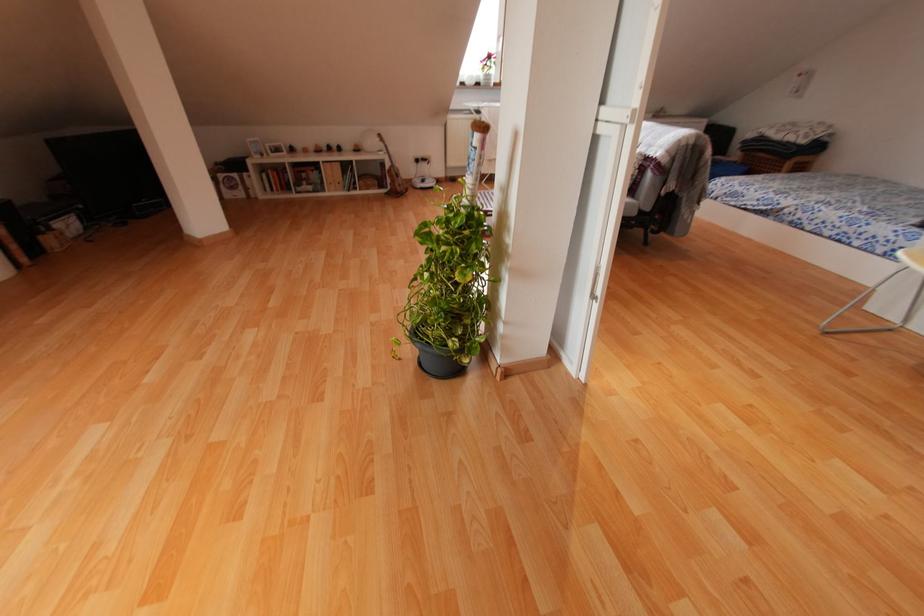
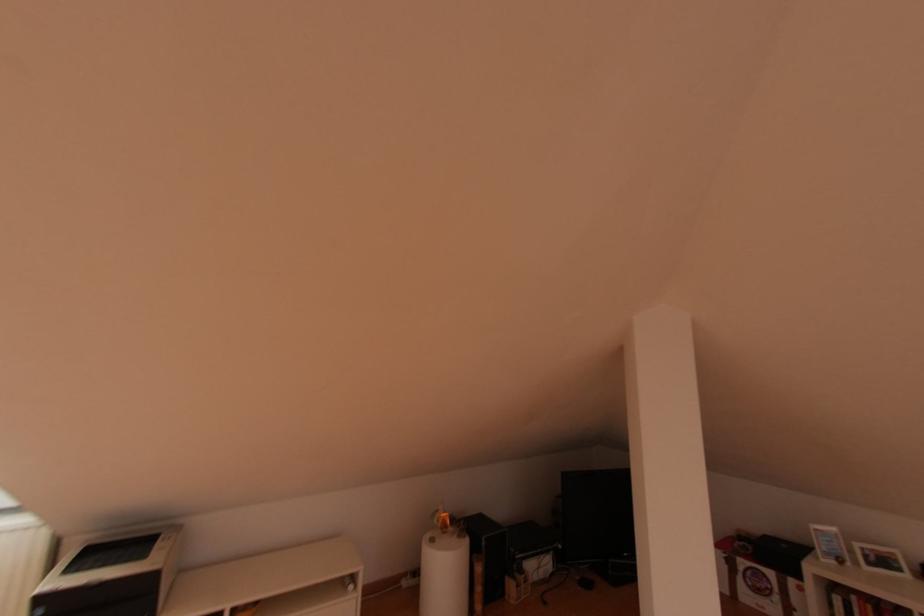
Locate, in the second image, the point that corresponds to [261,156] in the first image.

(840, 562)